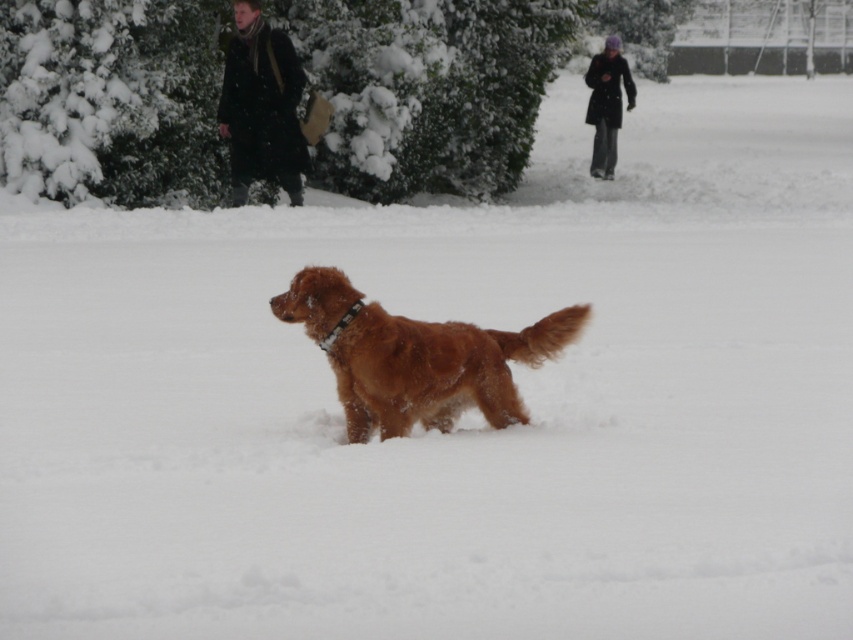
Is dark brown leather coat at upper left above dark gray wool coat at upper right?

No, dark brown leather coat at upper left is not above dark gray wool coat at upper right.

Is dark brown leather coat at upper left positioned at the back of dark gray wool coat at upper right?

No, it is not.

Is point (248, 157) less distant than point (604, 42)?

Yes, point (248, 157) is in front of point (604, 42).

Identify the location of dark brown leather coat at upper left. This screenshot has height=640, width=853. (260, 106).

Does point (424, 426) lie in front of point (234, 179)?

That is True.

The width and height of the screenshot is (853, 640). Describe the element at coordinates (416, 356) in the screenshot. I see `brown furry dog at center` at that location.

Locate an element on the screen. brown furry dog at center is located at coordinates (416, 356).

Measure the distance between brown furry dog at center and camera.

brown furry dog at center and camera are 26.90 feet apart.

Can you confirm if brown furry dog at center is shorter than dark gray wool coat at upper right?

No.

Who is more distant from viewer, [364,394] or [621,56]?

Positioned behind is point [621,56].

Identify the location of brown furry dog at center. (416, 356).